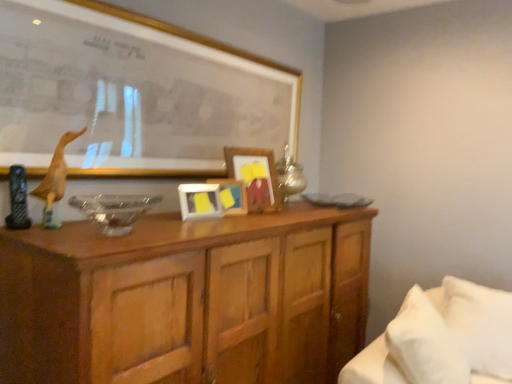
Question: Which direction should I rotate to look at yellow matte picture frame at center, acting as the 3th picture frame starting from the front, — up or down?

Choices:
 (A) up
 (B) down

Answer: (B)

Question: Is matte yellow picture frame at center, which ranks as the third picture frame in back-to-front order, further to camera compared to wooden duckling at left?

Choices:
 (A) yes
 (B) no

Answer: (A)

Question: Does matte yellow picture frame at center, which ranks as the third picture frame in back-to-front order, lie in front of wooden duckling at left?

Choices:
 (A) yes
 (B) no

Answer: (B)

Question: Could you tell me if matte yellow picture frame at center, which ranks as the third picture frame in back-to-front order, is turned towards wooden duckling at left?

Choices:
 (A) yes
 (B) no

Answer: (B)

Question: Can you confirm if matte yellow picture frame at center, which ranks as the third picture frame in back-to-front order, is smaller than wooden duckling at left?

Choices:
 (A) yes
 (B) no

Answer: (A)

Question: Would you say wooden duckling at left is part of matte yellow picture frame at center, the second picture frame in the front-to-back sequence,'s contents?

Choices:
 (A) yes
 (B) no

Answer: (B)

Question: Is matte yellow picture frame at center, which ranks as the third picture frame in back-to-front order, oriented away from wooden duckling at left?

Choices:
 (A) no
 (B) yes

Answer: (A)

Question: Does matte gold picture frame at upper center, positioned as the 4th picture frame in back-to-front order, appear on the left side of wooden duckling at left?

Choices:
 (A) no
 (B) yes

Answer: (A)

Question: Can you confirm if matte gold picture frame at upper center, which appears as the first picture frame when viewed from the front, is thinner than wooden duckling at left?

Choices:
 (A) yes
 (B) no

Answer: (B)

Question: Is matte gold picture frame at upper center, positioned as the 4th picture frame in back-to-front order, not near wooden duckling at left?

Choices:
 (A) no
 (B) yes

Answer: (A)

Question: Is the position of matte gold picture frame at upper center, positioned as the 4th picture frame in back-to-front order, less distant than that of wooden duckling at left?

Choices:
 (A) no
 (B) yes

Answer: (A)

Question: From the image's perspective, is matte gold picture frame at upper center, positioned as the 4th picture frame in back-to-front order, over wooden duckling at left?

Choices:
 (A) yes
 (B) no

Answer: (A)

Question: Is matte gold picture frame at upper center, which appears as the first picture frame when viewed from the front, shorter than wooden duckling at left?

Choices:
 (A) no
 (B) yes

Answer: (A)

Question: Is matte gold picture frame at upper center, which appears as the first picture frame when viewed from the front, to the left of white soft bed at lower right from the viewer's perspective?

Choices:
 (A) yes
 (B) no

Answer: (A)